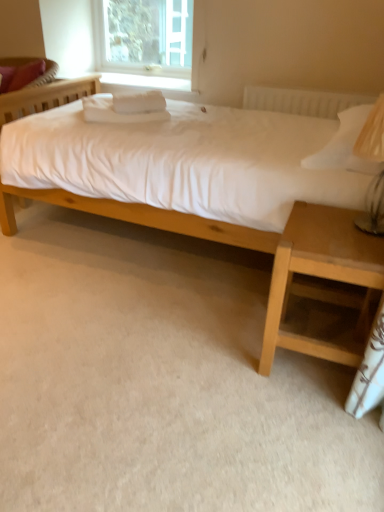
Question: From their relative heights in the image, would you say matte wood bed at center is taller or shorter than clear glass window at upper center?

Choices:
 (A) short
 (B) tall

Answer: (B)

Question: From the image's perspective, is matte wood bed at center located above or below clear glass window at upper center?

Choices:
 (A) below
 (B) above

Answer: (A)

Question: Estimate the real-world distances between objects in this image. Which object is closer to the matte wood bed at center?

Choices:
 (A) matte pink pillow at upper left
 (B) clear glass window at upper center
 (C) light brown wood nightstand at lower right

Answer: (C)

Question: Which is farther from the clear glass window at upper center?

Choices:
 (A) matte wood bed at center
 (B) matte pink pillow at upper left
 (C) light brown wood nightstand at lower right

Answer: (C)